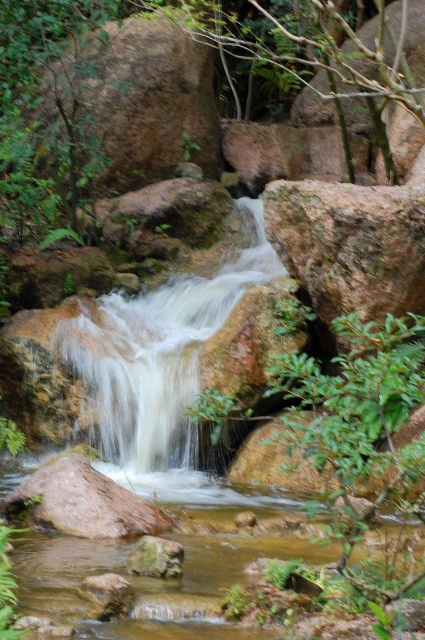
Is gray rough rock at center to the right of smooth brown rock at lower center from the viewer's perspective?

Correct, you'll find gray rough rock at center to the right of smooth brown rock at lower center.

Which is below, gray rough rock at center or smooth brown rock at lower center?

smooth brown rock at lower center is below.

Describe the element at coordinates (350, 246) in the screenshot. The image size is (425, 640). I see `gray rough rock at center` at that location.

The height and width of the screenshot is (640, 425). Find the location of `gray rough rock at center`. gray rough rock at center is located at coordinates (350, 246).

Can you confirm if rustic granite boulder at upper left is bigger than smooth brown rock at center?

Correct, rustic granite boulder at upper left is larger in size than smooth brown rock at center.

Is point (108, 125) positioned in front of point (144, 531)?

No, it is not.

Is point (53, 65) positioned behind point (136, 525)?

Yes, point (53, 65) is farther from viewer.

This screenshot has width=425, height=640. What are the coordinates of `rustic granite boulder at upper left` in the screenshot? It's located at (136, 100).

Find the location of a particular element. Image resolution: width=425 pixels, height=640 pixels. smooth brown rock at center is located at coordinates (84, 502).

Which is below, smooth brown rock at center or smooth brown rock at lower center?

smooth brown rock at lower center is lower down.

Does point (107, 504) come behind point (170, 568)?

Yes, it is.

What are the coordinates of `smooth brown rock at center` in the screenshot? It's located at (84, 502).